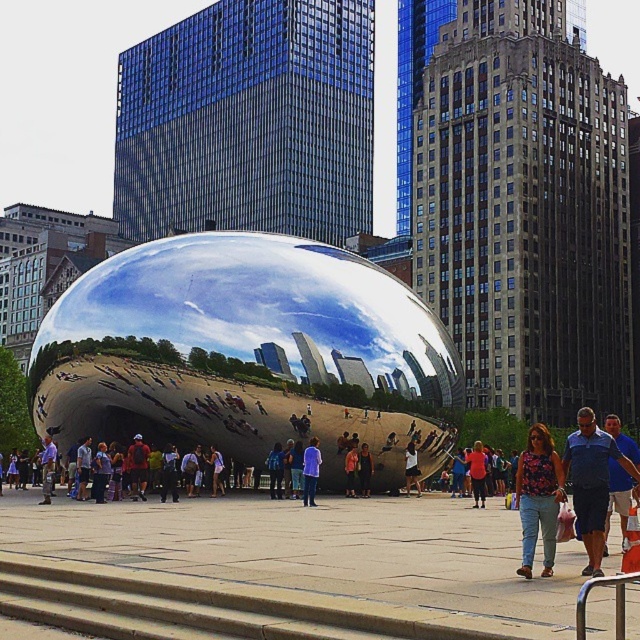
You are a photographer aiming to capture a candid shot of the person wearing the floral print shirt at center and denim shorts at center. Since you want to focus on their clothing details, which part of their outfit should you aim the camera at to ensure both items are in frame?

The floral print shirt at center is positioned under denim shorts at center, so aiming the camera at the lower half of the person wearing the floral print shirt at center and denim shorts at center will ensure both items are in frame.